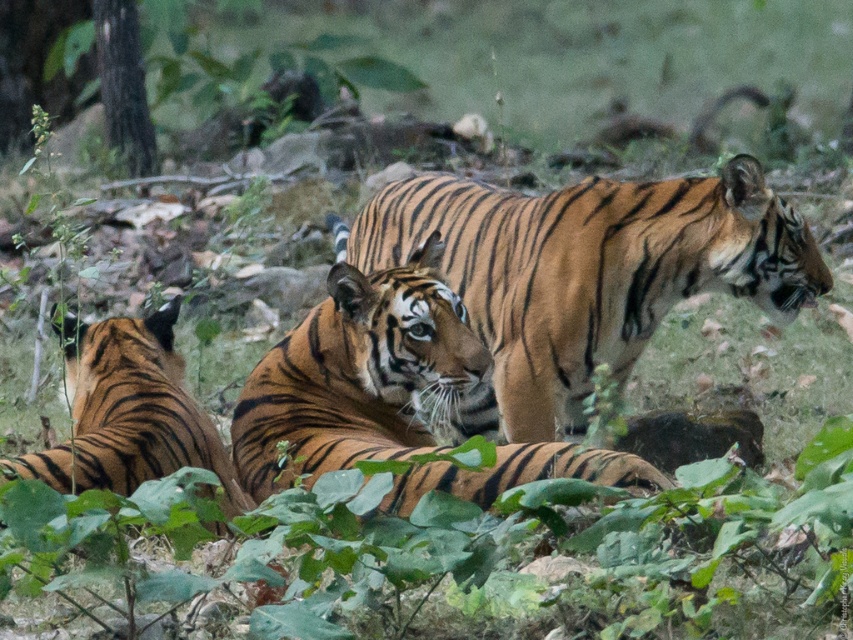
Question: Which point is farther from the camera taking this photo?

Choices:
 (A) (468, 336)
 (B) (67, 317)
 (C) (308, 612)

Answer: (B)

Question: Which object is the farthest from the orange-brown striped tiger at center?

Choices:
 (A) orange striped tiger at center
 (B) orange striped tiger at lower left
 (C) green leafy foliage at center

Answer: (C)

Question: Can you confirm if orange striped tiger at center is thinner than orange striped tiger at lower left?

Choices:
 (A) no
 (B) yes

Answer: (A)

Question: Does orange-brown striped tiger at center lie behind orange striped tiger at lower left?

Choices:
 (A) no
 (B) yes

Answer: (B)

Question: Can you confirm if green leafy foliage at center is thinner than orange-brown striped tiger at center?

Choices:
 (A) no
 (B) yes

Answer: (A)

Question: Which of the following is the closest to the observer?

Choices:
 (A) orange striped tiger at center
 (B) green leafy foliage at center
 (C) orange-brown striped tiger at center
 (D) orange striped tiger at lower left

Answer: (B)